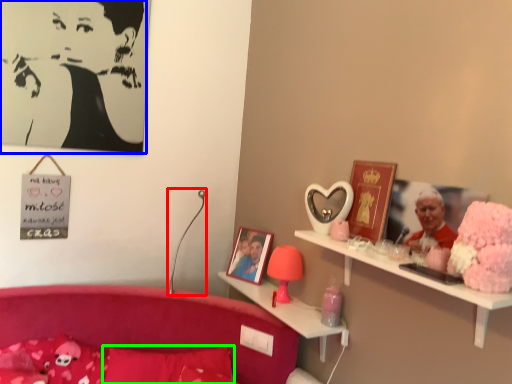
Question: Which object is positioned farthest from table lamp (highlighted by a red box)? Select from person (highlighted by a blue box) and pillow (highlighted by a green box).

Choices:
 (A) person
 (B) pillow

Answer: (A)